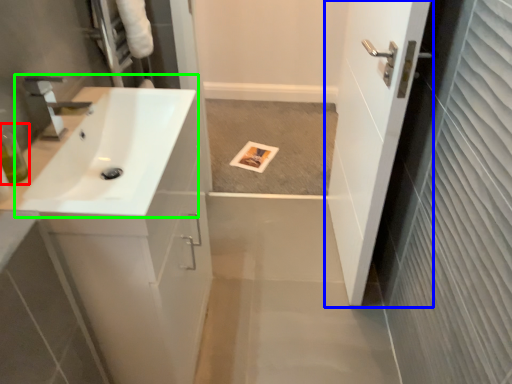
Question: Which object is the closest to the toiletry (highlighted by a red box)? Choose among these: door (highlighted by a blue box) or sink (highlighted by a green box).

Choices:
 (A) door
 (B) sink

Answer: (B)